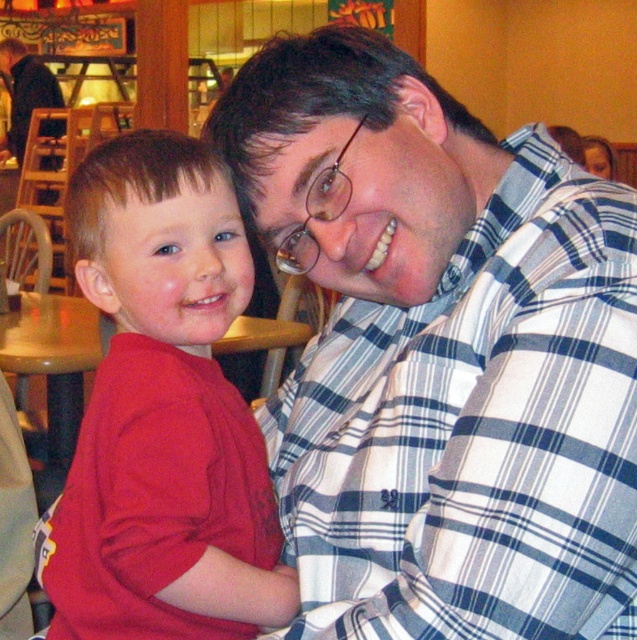
Question: Does white plaid shirt at upper right have a larger size compared to matte red shirt at left?

Choices:
 (A) no
 (B) yes

Answer: (B)

Question: Can you confirm if white plaid shirt at upper right is positioned below matte red shirt at left?

Choices:
 (A) no
 (B) yes

Answer: (A)

Question: Which of the following is the farthest from the observer?

Choices:
 (A) (441, 602)
 (B) (83, 458)

Answer: (B)

Question: Which point is farther from the camera taking this photo?

Choices:
 (A) (125, 627)
 (B) (375, 497)

Answer: (A)

Question: Can you confirm if white plaid shirt at upper right is smaller than matte red shirt at left?

Choices:
 (A) no
 (B) yes

Answer: (A)